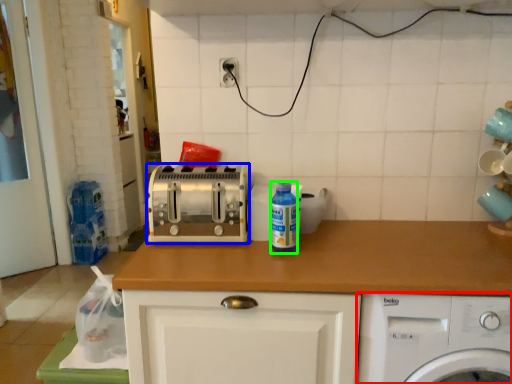
Question: Which object is the closest to the home appliance (highlighted by a red box)? Choose among these: toaster (highlighted by a blue box) or bottle (highlighted by a green box).

Choices:
 (A) toaster
 (B) bottle

Answer: (B)